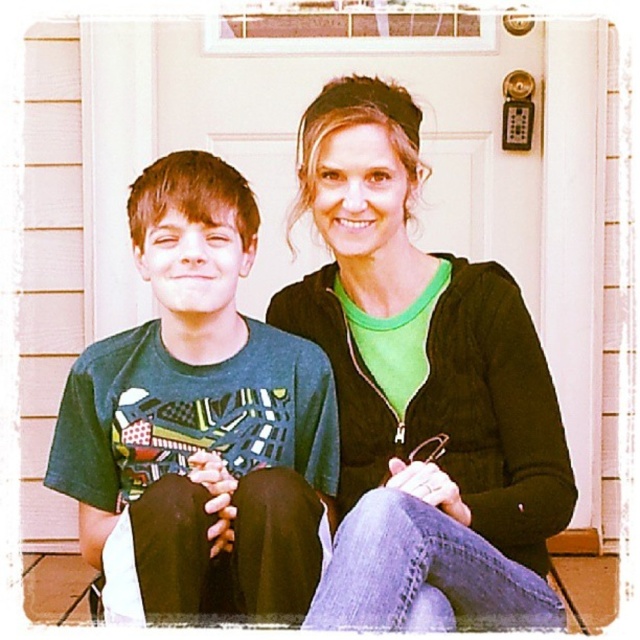
Question: Is green matte jacket at center wider than green matte shirt at center?

Choices:
 (A) no
 (B) yes

Answer: (B)

Question: Is green matte jacket at center below green matte shirt at center?

Choices:
 (A) yes
 (B) no

Answer: (B)

Question: Can you confirm if green matte jacket at center is thinner than green matte shirt at center?

Choices:
 (A) no
 (B) yes

Answer: (A)

Question: Which object appears farthest from the camera in this image?

Choices:
 (A) green matte shirt at center
 (B) green matte jacket at center

Answer: (A)